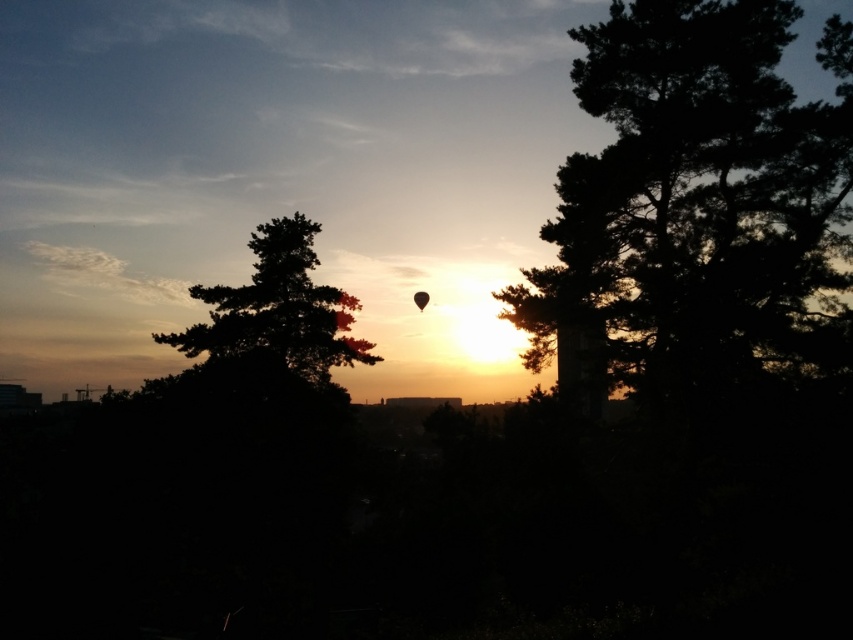
Between dark green textured tree at right and translucent orange balloon at center, which one appears on the left side from the viewer's perspective?

Positioned to the left is translucent orange balloon at center.

Who is more forward, (x=839, y=92) or (x=346, y=312)?

Point (x=839, y=92) is in front.

Does point (683, 173) come farther from viewer compared to point (345, 316)?

No.

Where is `dark green textured tree at right`? This screenshot has width=853, height=640. dark green textured tree at right is located at coordinates (688, 200).

Can you confirm if dark green textured tree at right is positioned below transparent black balloon at center?

Correct, dark green textured tree at right is located below transparent black balloon at center.

Between dark green textured tree at right and transparent black balloon at center, which one appears on the left side from the viewer's perspective?

From the viewer's perspective, transparent black balloon at center appears more on the left side.

What do you see at coordinates (688, 200) in the screenshot? I see `dark green textured tree at right` at bounding box center [688, 200].

Find the location of a particular element. The width and height of the screenshot is (853, 640). dark green textured tree at right is located at coordinates (688, 200).

Does silhouette tree at left have a greater width compared to translucent orange balloon at center?

Yes, silhouette tree at left is wider than translucent orange balloon at center.

How far apart are silhouette tree at left and translucent orange balloon at center?

silhouette tree at left is 2.21 meters from translucent orange balloon at center.

Between point (258, 280) and point (349, 324), which one is positioned behind?

Point (349, 324)

Locate an element on the screen. Image resolution: width=853 pixels, height=640 pixels. silhouette tree at left is located at coordinates (277, 308).